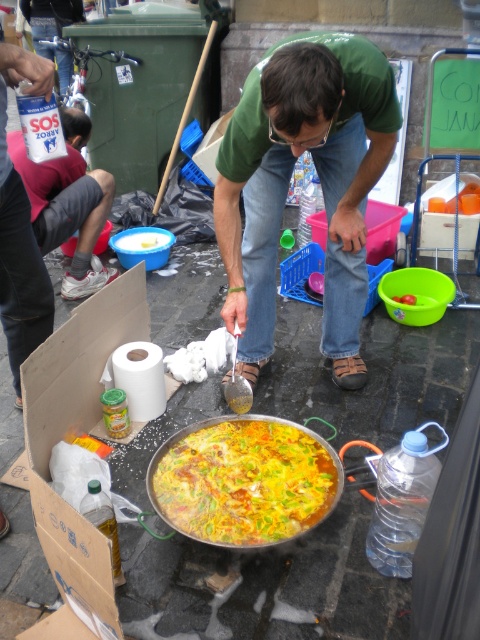
Question: Does green matte shirt at center lie behind yellowish matte paella at center?

Choices:
 (A) no
 (B) yes

Answer: (A)

Question: Based on their relative distances, which object is nearer to the vibrant yellow and green vegetables at center?

Choices:
 (A) yellowish matte paella at center
 (B) matte green shirt at center

Answer: (A)

Question: Is green matte shirt at center above vibrant yellow and green vegetables at center?

Choices:
 (A) yes
 (B) no

Answer: (A)

Question: Is vibrant yellow and green vegetables at center wider than yellowish matte paella at center?

Choices:
 (A) yes
 (B) no

Answer: (A)

Question: Considering the real-world distances, which object is closest to the green matte shirt at center?

Choices:
 (A) vibrant yellow and green vegetables at center
 (B) yellowish matte paella at center

Answer: (A)

Question: Estimate the real-world distances between objects in this image. Which object is farther from the green matte shirt at center?

Choices:
 (A) yellowish matte paella at center
 (B) vibrant yellow and green vegetables at center
 (C) white paper towel at lower center
 (D) matte green shirt at center

Answer: (D)